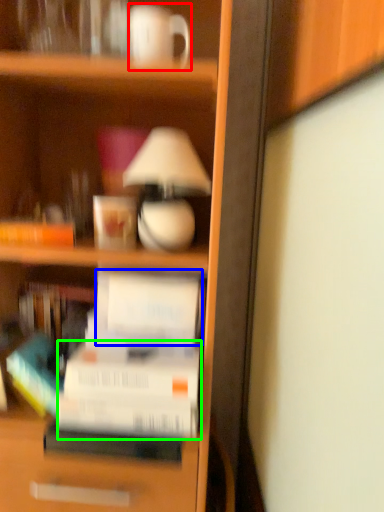
Question: Which object is the closest to the coffee cup (highlighted by a red box)? Choose among these: paperback book (highlighted by a blue box) or paperback book (highlighted by a green box).

Choices:
 (A) paperback book
 (B) paperback book

Answer: (A)